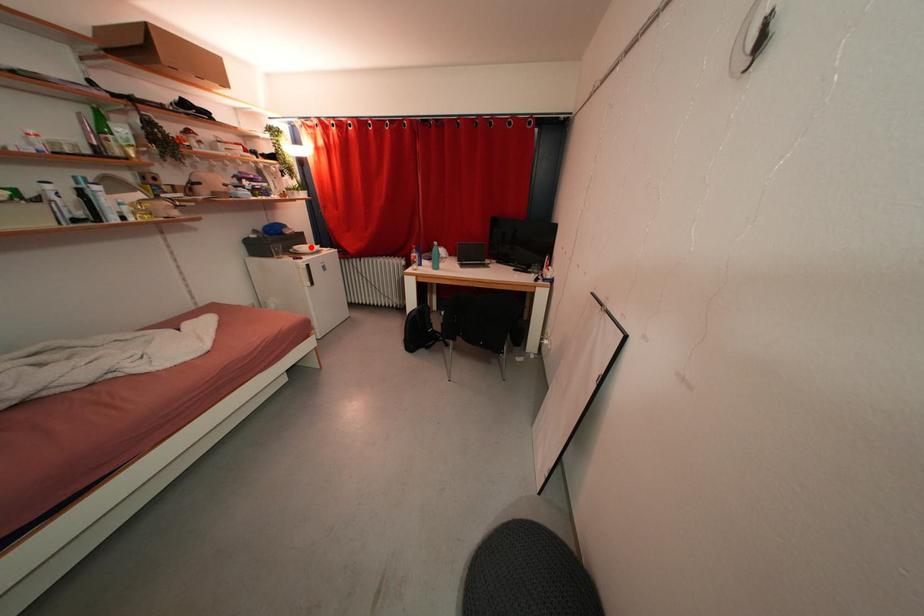
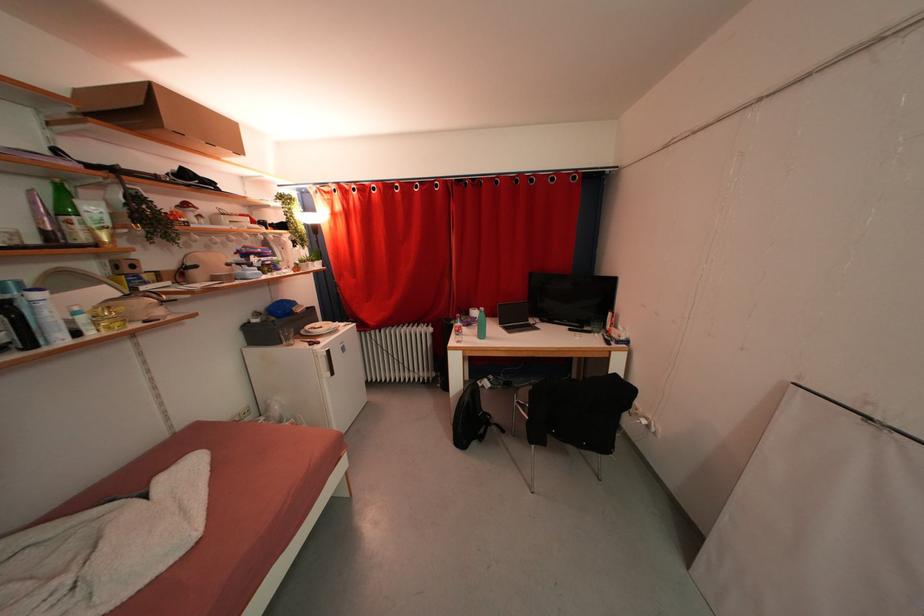
The point at the highlighted location is marked in the first image. Where is the corresponding point in the second image?

(322, 323)